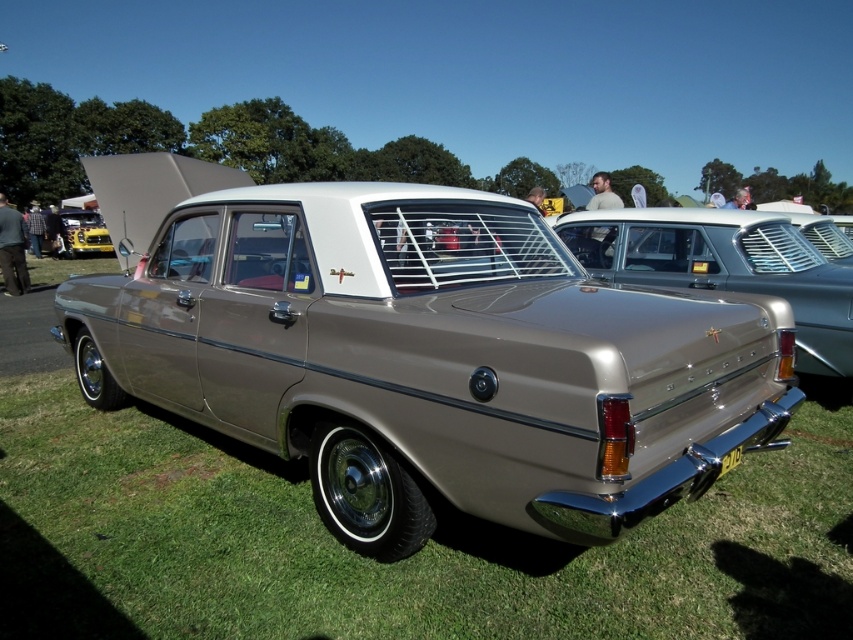
Consider the image. You are a photographer planning to take a photo of the metallic gold car at center and the yellow metallic car at left. Since you want to ensure both cars are fully visible in the frame, which car should you position closer to the camera to avoid cropping?

The metallic gold car at center is much taller than the yellow metallic car at left. To ensure both are fully visible, position the metallic gold car at center closer to the camera so its height fits within the frame without cropping.

You are standing in a park where a vintage Holden car is parked. You notice a point marked at coordinate (379, 253). If you want to take a photo of this point from where you are standing, will you be able to capture it in your camera frame without moving? The camera has a maximum focus range of 2.5 meters.

The point at (379, 253) is 2.74 meters away from the camera. Since the camera can only focus up to 2.5 meters, you won not be able to capture it clearly without moving closer.

You are a photographer trying to capture both the metallic gold car at center and the yellow metallic car at left in a single frame. Given that your camera can only accommodate objects up to the width of the wider car, which car should you position closer to the camera to ensure both fit in the frame?

The metallic gold car at center is wider than the yellow metallic car at left. To ensure both fit in the frame, position the metallic gold car at center closer to the camera since its width is greater, allowing you to adjust its size relative to the camera lens.